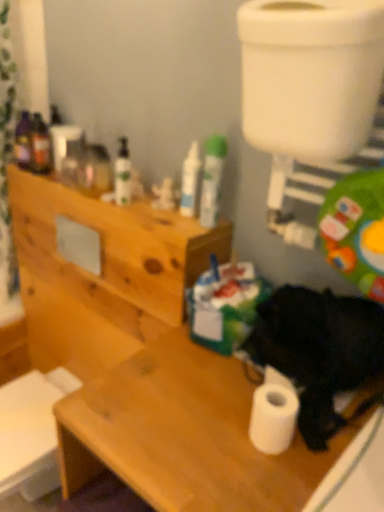
Find the location of a particular element. The image size is (384, 512). vacant area that lies in front of white glossy tube at upper center, which is counted as the 2th toiletry, starting from the left is located at coordinates (182, 224).